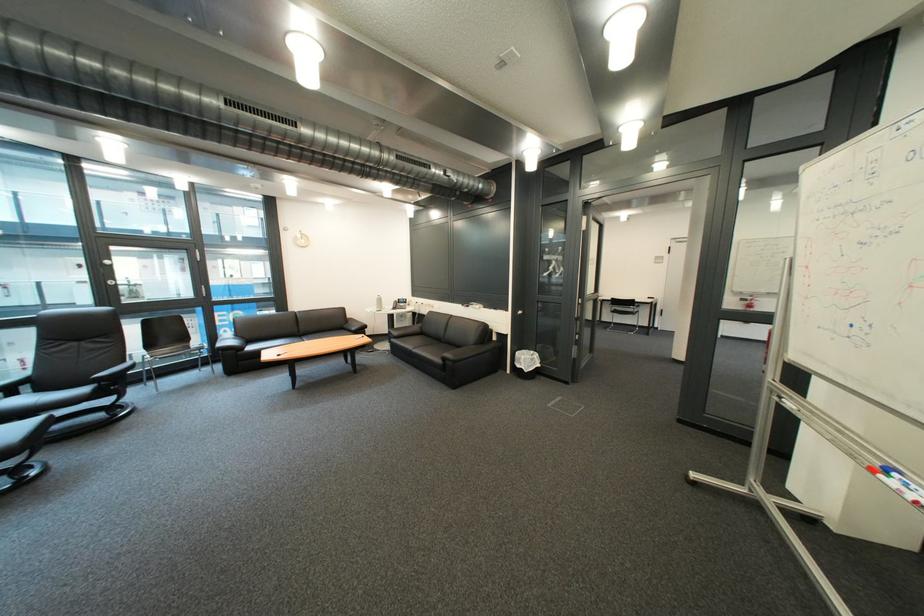
The image size is (924, 616). I want to click on white trash can, so click(x=526, y=363).